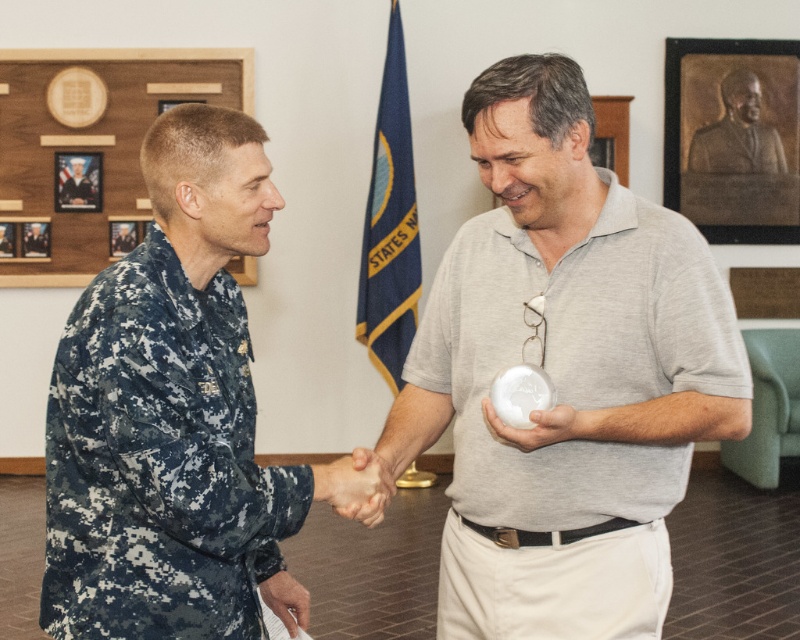
Question: Which object appears farthest from the camera in this image?

Choices:
 (A) digital camouflage uniform at left
 (B) white glossy sphere at center
 (C) camouflage uniform at center
 (D) bronze bust at upper right

Answer: (D)

Question: Does white glossy sphere at center come behind camouflage uniform at center?

Choices:
 (A) yes
 (B) no

Answer: (B)

Question: Does white glossy sphere at center appear over bronze bust at upper right?

Choices:
 (A) yes
 (B) no

Answer: (B)

Question: Which of these objects is positioned farthest from the bronze bust at upper right?

Choices:
 (A) camouflage uniform at center
 (B) digital camouflage uniform at left

Answer: (B)

Question: Can you confirm if white glossy sphere at center is smaller than bronze bust at upper right?

Choices:
 (A) no
 (B) yes

Answer: (A)

Question: Which of these objects is positioned farthest from the white glossy sphere at center?

Choices:
 (A) camouflage uniform at center
 (B) digital camouflage uniform at left

Answer: (A)